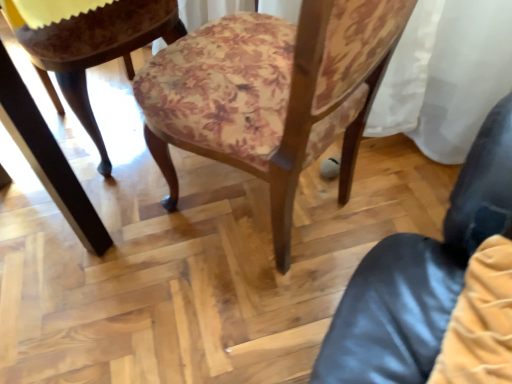
I want to click on free space to the left of floral fabric chair at center, so click(103, 283).